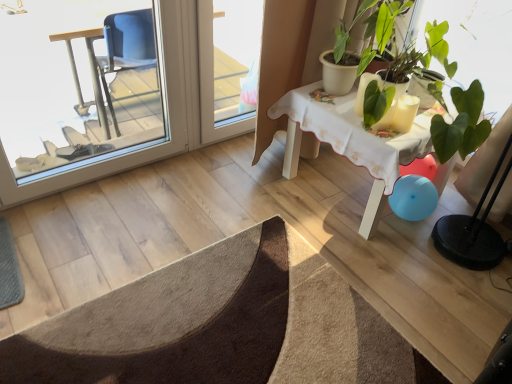
The width and height of the screenshot is (512, 384). I want to click on vacant region under white wooden table at upper right (from a real-world perspective), so click(337, 186).